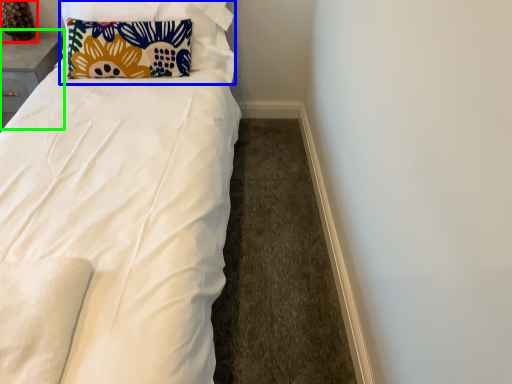
Question: Which is farther away from table lamp (highlighted by a red box)? pillow (highlighted by a blue box) or table (highlighted by a green box)?

Choices:
 (A) pillow
 (B) table

Answer: (A)